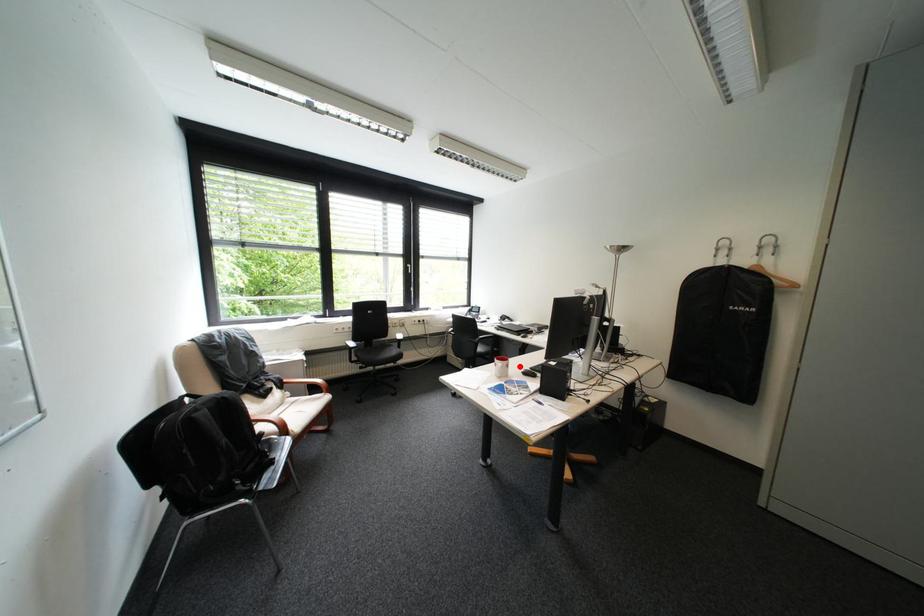
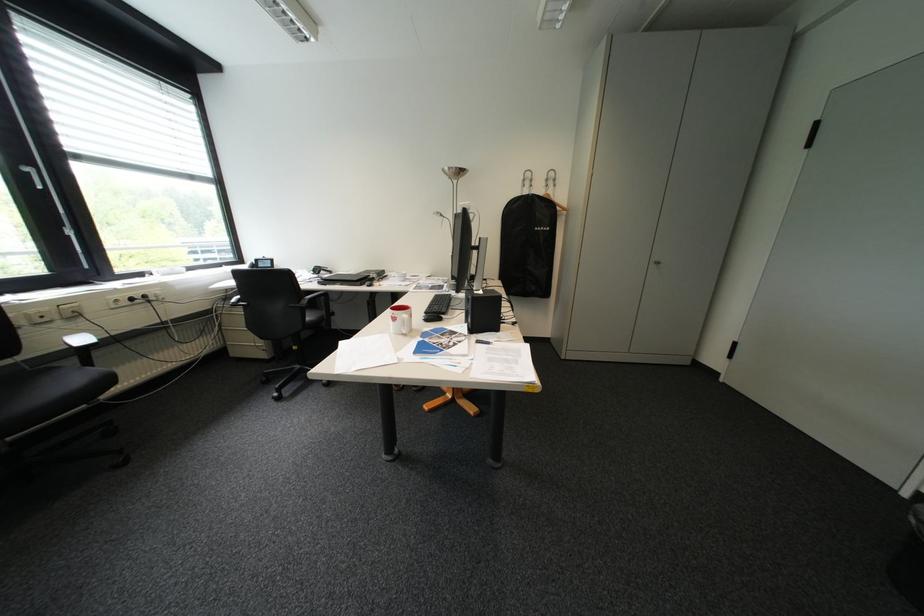
In the second image, find the point that corresponds to the highlighted location in the first image.

(423, 315)